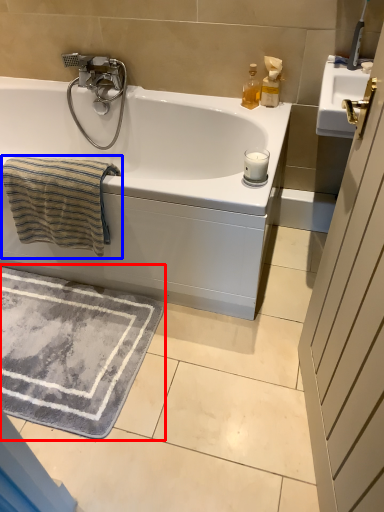
Question: Which point is further to the camera, bath mat (highlighted by a red box) or beach towel (highlighted by a blue box)?

Choices:
 (A) bath mat
 (B) beach towel

Answer: (A)